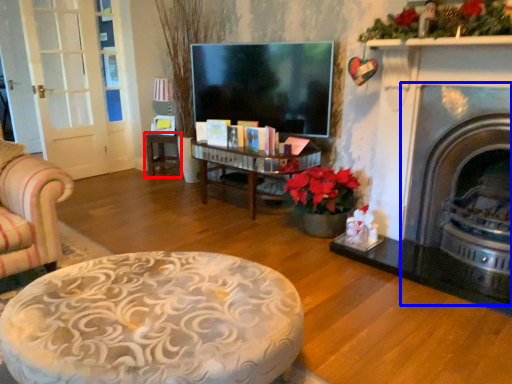
Question: Which object is further to the camera taking this photo, table (highlighted by a red box) or fireplace (highlighted by a blue box)?

Choices:
 (A) table
 (B) fireplace

Answer: (A)